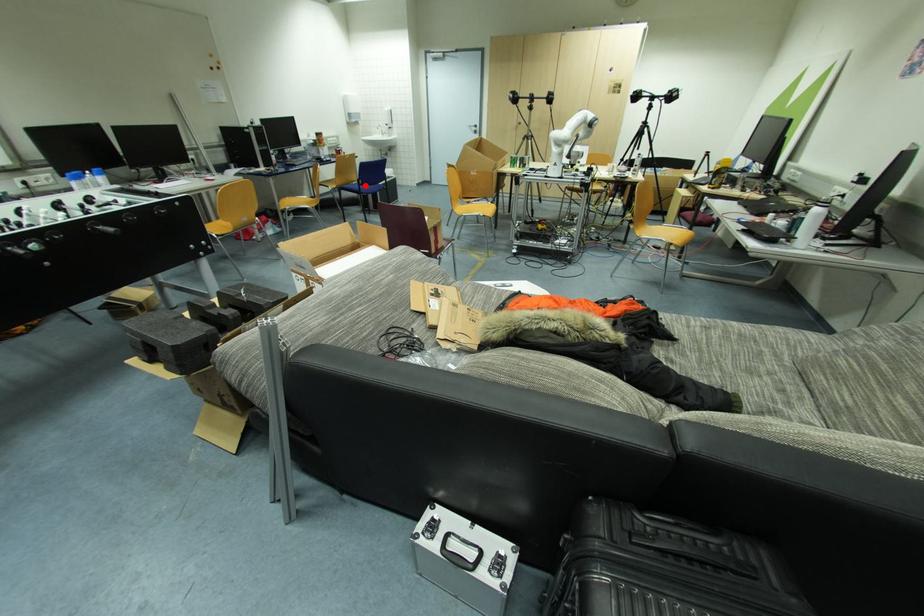
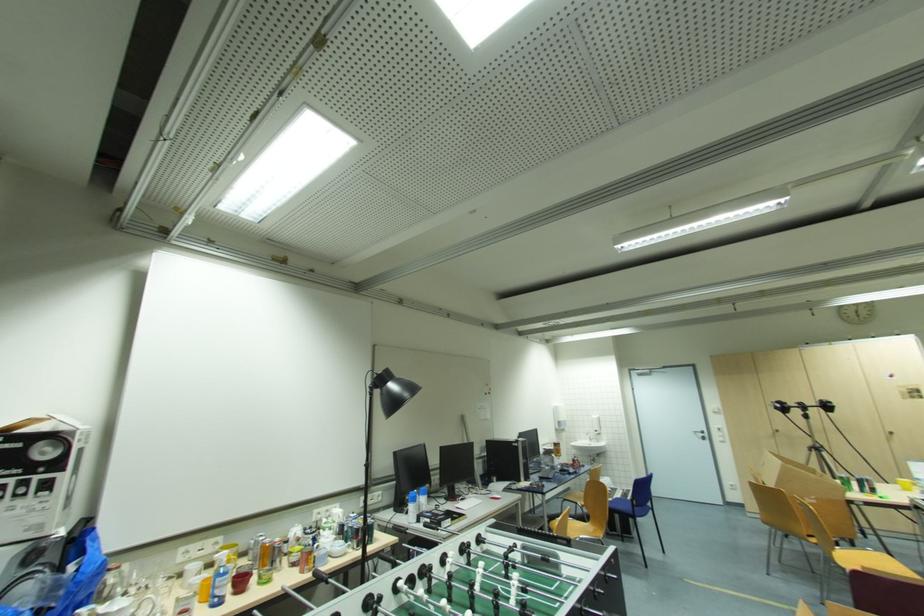
Question: I am providing you with two images of the same scene from different viewpoints. Given a red point in image1, look at the same physical point in image2. Is it:

Choices:
 (A) Closer to the viewpoint
 (B) Farther from the viewpoint

Answer: (B)